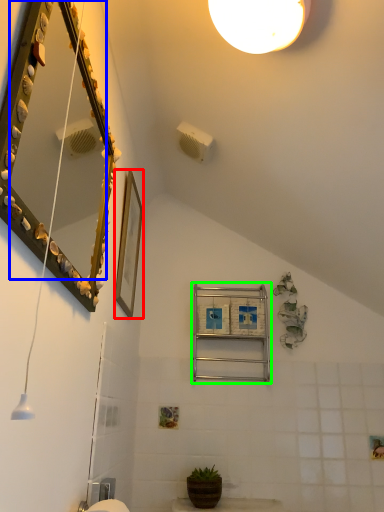
Question: Estimate the real-world distances between objects in this image. Which object is farther from picture frame (highlighted by a red box), mirror (highlighted by a blue box) or ladder (highlighted by a green box)?

Choices:
 (A) mirror
 (B) ladder

Answer: (B)